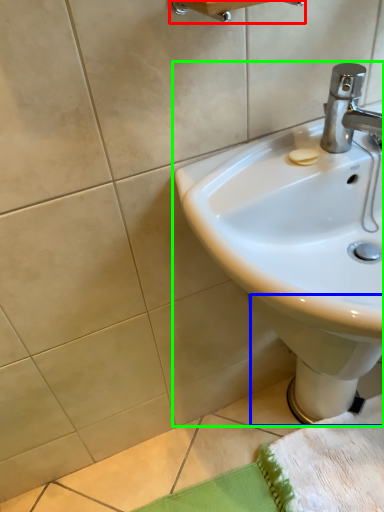
Question: Estimate the real-world distances between objects in this image. Which object is farther from towel bar (highlighted by a red box), bidet (highlighted by a blue box) or sink (highlighted by a green box)?

Choices:
 (A) bidet
 (B) sink

Answer: (A)